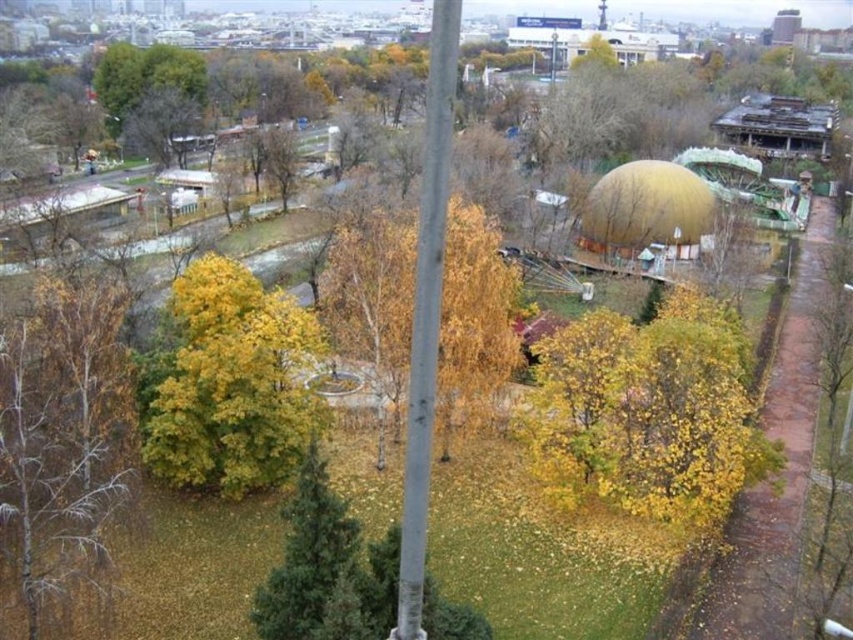
Does yellow-green foliage at center-left appear over green matte tree at center?

Yes, yellow-green foliage at center-left is above green matte tree at center.

From the picture: Can you confirm if yellow-green foliage at center-left is taller than green matte tree at center?

Indeed, yellow-green foliage at center-left has a greater height compared to green matte tree at center.

Locate an element on the screen. yellow-green foliage at center-left is located at coordinates (230, 384).

Is yellow matte tree at lower right thinner than yellow leafy tree at center?

Incorrect, yellow matte tree at lower right's width is not less than yellow leafy tree at center's.

Who is taller, yellow matte tree at lower right or yellow leafy tree at center?

With more height is yellow leafy tree at center.

You are a GUI agent. You are given a task and a screenshot of the screen. Output one action in this format:
    pyautogui.click(x=<x>, y=<y>)
    Task: Click on the yellow matte tree at lower right
    This screenshot has height=640, width=853.
    Given the screenshot: What is the action you would take?
    pyautogui.click(x=648, y=410)

Is yellow matte tree at lower right below silver metallic pole at center?

No.

This screenshot has height=640, width=853. Describe the element at coordinates (648, 410) in the screenshot. I see `yellow matte tree at lower right` at that location.

Describe the element at coordinates (648, 410) in the screenshot. This screenshot has width=853, height=640. I see `yellow matte tree at lower right` at that location.

The image size is (853, 640). I want to click on yellow matte tree at lower right, so point(648,410).